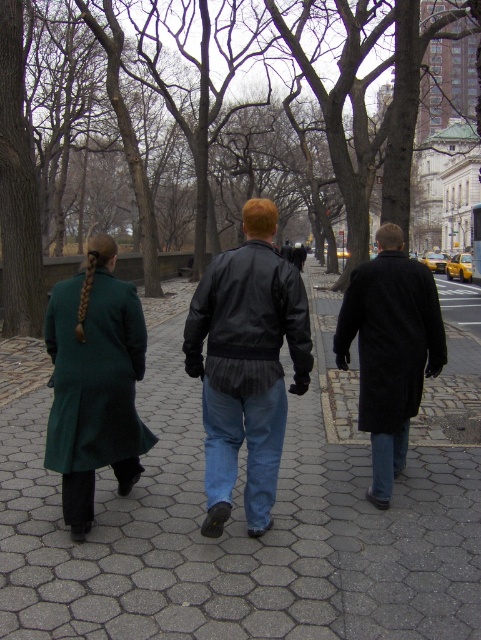
You are standing at the camera position looking at the three people walking away from you. The point at coordinates (95, 376) is located on one of their coats. Which person is this point on?

The point at coordinates (95, 376) is on the green wool coat at left.

You are a photographer trying to capture a group photo of the three people walking on the pathway. Since you want to ensure that both the green wool coat at left and the silky brown hair at center are clearly visible in the frame, which object should you focus on first to ensure proper focus, considering their sizes?

The green wool coat at left is bigger than silky brown hair at center, so focusing on the green wool coat at left first will ensure proper focus since it is larger and easier to detect.

You are standing at the point with coordinates (247, 449). You want to walk to the blue denim jeans at center. Which direction should you walk?

You are already at the location of the blue denim jeans at center, so you don not need to move.